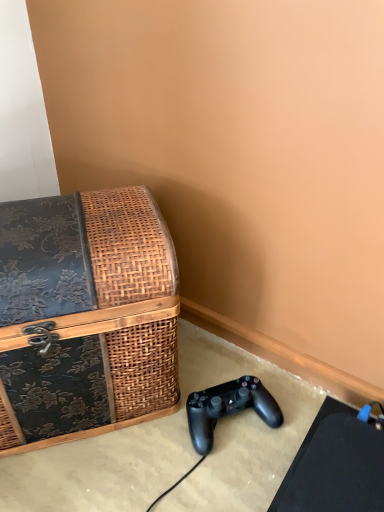
Question: In the image, is black matte game controller at lower right positioned in front of or behind woven wood trunk at left?

Choices:
 (A) front
 (B) behind

Answer: (B)

Question: Is black matte game controller at lower right wider or thinner than woven wood trunk at left?

Choices:
 (A) wide
 (B) thin

Answer: (B)

Question: Which is correct: black matte game controller at lower right is inside woven wood trunk at left, or outside of it?

Choices:
 (A) inside
 (B) outside

Answer: (B)

Question: Considering the positions of woven wood trunk at left and black matte game controller at lower right in the image, is woven wood trunk at left bigger or smaller than black matte game controller at lower right?

Choices:
 (A) big
 (B) small

Answer: (A)

Question: Is woven wood trunk at left spatially inside black matte game controller at lower right, or outside of it?

Choices:
 (A) outside
 (B) inside

Answer: (A)

Question: From a real-world perspective, is woven wood trunk at left above or below black matte game controller at lower right?

Choices:
 (A) above
 (B) below

Answer: (A)

Question: Considering the positions of woven wood trunk at left and black matte game controller at lower right in the image, is woven wood trunk at left taller or shorter than black matte game controller at lower right?

Choices:
 (A) tall
 (B) short

Answer: (A)